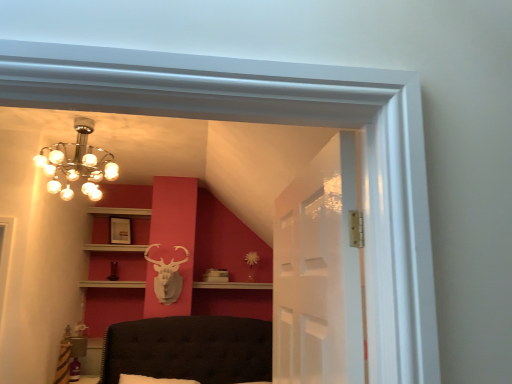
The image size is (512, 384). Find the location of `blank space above matte white picture frame at upper center (from a real-world perspective)`. blank space above matte white picture frame at upper center (from a real-world perspective) is located at coordinates (123, 213).